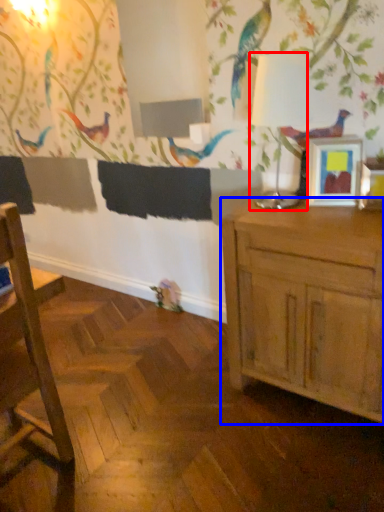
Question: Which of the following is the closest to the observer, table lamp (highlighted by a red box) or cabinetry (highlighted by a blue box)?

Choices:
 (A) table lamp
 (B) cabinetry

Answer: (B)